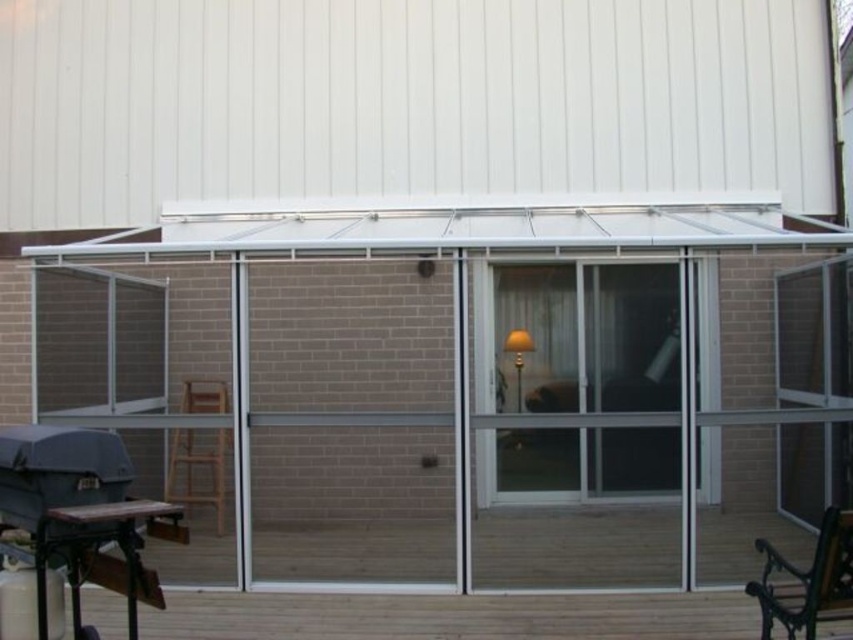
You are planning to place a large potted plant that requires a surface area of 1.5 square meters. Based on the scene, which object between the wooden deck at lower center and the wooden chair at lower left can accommodate this plant?

The wooden deck at lower center is bigger than the wooden chair at lower left, so the wooden deck at lower center can accommodate the large potted plant requiring 1.5 square meters.

Consider the image. You are planning to host a small gathering and need to place a 1.5 meter long rectangular table between the matte black barbecue grill at lower left and the metallic green bench at lower right. Considering their sizes, will there be enough space to fit the table without moving either object?

The matte black barbecue grill at lower left is larger than the metallic green bench at lower right. However, without specific measurements of the distance between them, it is impossible to determine if the 1.5 meter table will fit. Additional information about the spacing between the two objects is required to answer this accurately.

You are planning to move a 1.2 meter wide dining table to the patio. The matte black barbecue grill at lower left and the wooden chair at lower left are currently occupying space there. Can you fit the dining table between them without moving either object?

The matte black barbecue grill at lower left might be wider than wooden chair at lower left, so there might not be enough space to fit the 1.2 meter wide dining table between them without moving either object.